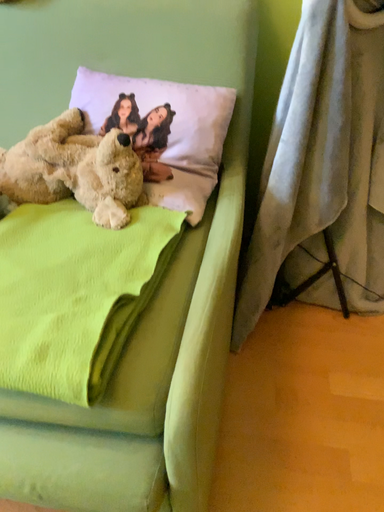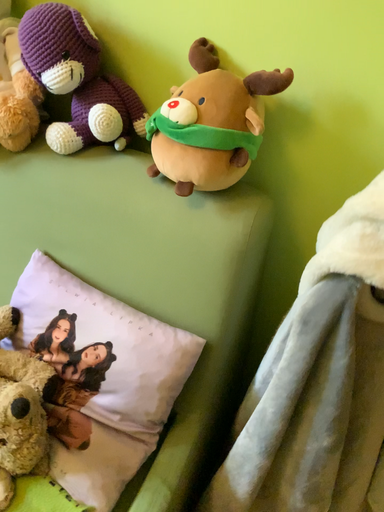
Question: Which way did the camera rotate in the video?

Choices:
 (A) rotated left
 (B) rotated right

Answer: (A)